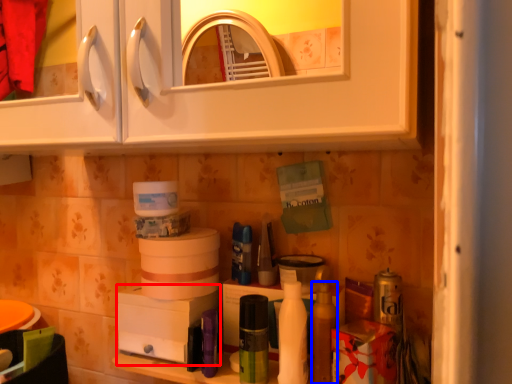
Question: Which of the following is the farthest to the observer, appliance (highlighted by a red box) or toiletry (highlighted by a blue box)?

Choices:
 (A) appliance
 (B) toiletry

Answer: (A)